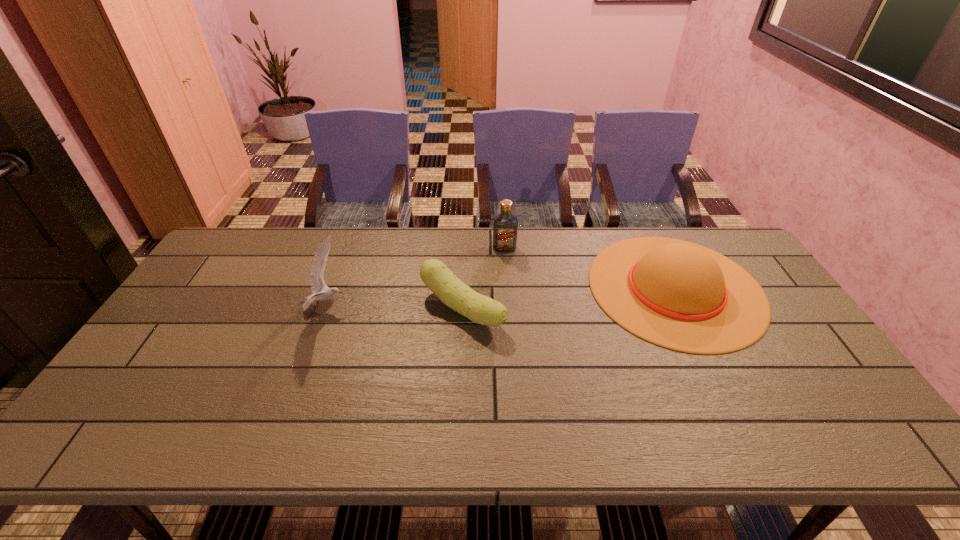
Where is `vodka`? The height and width of the screenshot is (540, 960). vodka is located at coordinates (505, 225).

The image size is (960, 540). I want to click on gull, so click(x=317, y=283).

Image resolution: width=960 pixels, height=540 pixels. What are the coordinates of `sombrero` in the screenshot? It's located at (682, 296).

Identify the location of the third tallest object. (682, 296).

Where is `the shortest object`? This screenshot has width=960, height=540. the shortest object is located at coordinates pyautogui.click(x=455, y=294).

At what (x,y) coordinates should I click in order to perform the action: click on free space located on the front-facing side of the vodka. Please return your answer as a coordinate pair (x, y). This screenshot has width=960, height=540. Looking at the image, I should click on (508, 303).

You are a GUI agent. You are given a task and a screenshot of the screen. Output one action in this format:
    pyautogui.click(x=<x>, y=<y>)
    Task: Click on the vacant area situated 0.160m at the tip of the beak of the leftmost object
    
    Given the screenshot: What is the action you would take?
    pyautogui.click(x=401, y=308)

What are the coordinates of `vacant region located on the left of the second shortest object` in the screenshot? It's located at (512, 288).

Identify the location of free space located 0.160m on the back of the cucumber. The width and height of the screenshot is (960, 540). (465, 252).

The image size is (960, 540). Identify the location of vodka that is at the far edge. (505, 225).